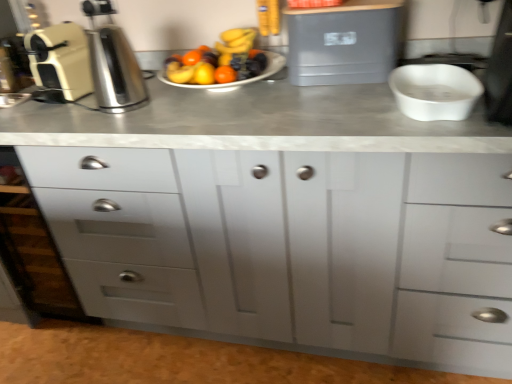
Find the location of a particular element. This screenshot has height=384, width=512. free space below white glossy mixing bowl at right (from a real-world perspective) is located at coordinates (425, 104).